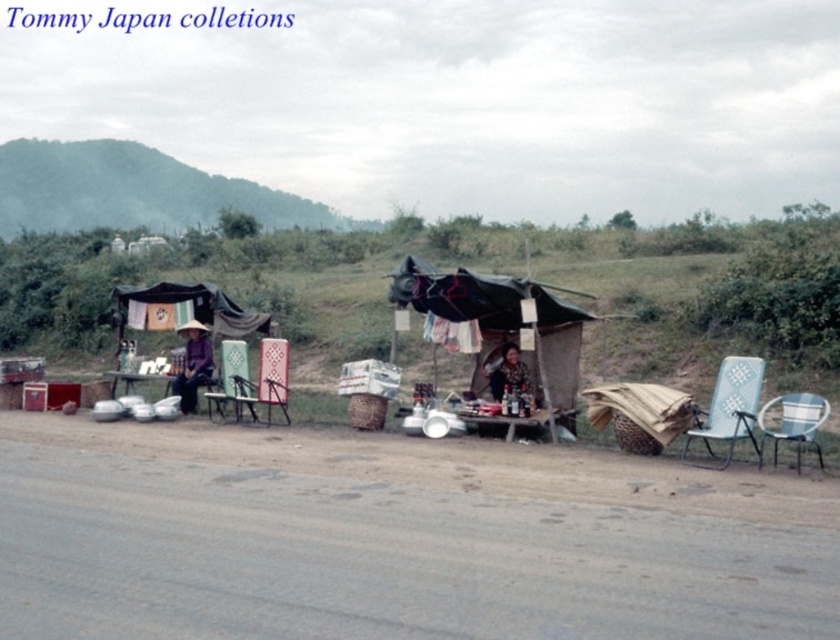
How much distance is there between light blue plastic chair at right and plastic/metallic chair at right?

light blue plastic chair at right is 18.24 inches from plastic/metallic chair at right.

Consider the image. Is light blue plastic chair at right positioned behind plastic/metallic chair at right?

Yes, it is behind plastic/metallic chair at right.

In order to click on light blue plastic chair at right in this screenshot , I will do `click(728, 406)`.

This screenshot has height=640, width=840. Identify the location of light blue plastic chair at right. (728, 406).

Consider the image. Does green woven chair at center have a greater height compared to dark brown woven basket at center?

Correct, green woven chair at center is much taller as dark brown woven basket at center.

The image size is (840, 640). In order to click on green woven chair at center in this screenshot , I will do `click(229, 372)`.

Which is in front, point (222, 362) or point (526, 394)?

Point (526, 394) is in front.

What are the coordinates of `green woven chair at center` in the screenshot? It's located at (229, 372).

Identify the location of light blue plastic chair at right. (728, 406).

Between point (744, 420) and point (512, 342), which one is positioned in front?

Point (744, 420)

Image resolution: width=840 pixels, height=640 pixels. I want to click on light blue plastic chair at right, so click(x=728, y=406).